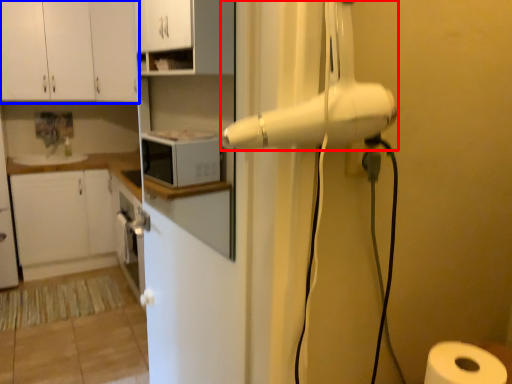
Question: Which of the following is the farthest to the observer, home appliance (highlighted by a red box) or cabinetry (highlighted by a blue box)?

Choices:
 (A) home appliance
 (B) cabinetry

Answer: (B)